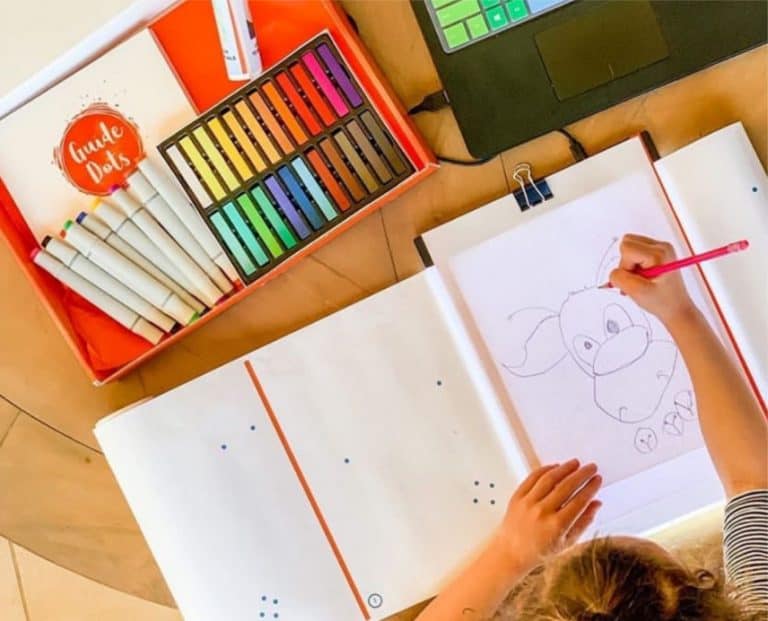
Where is `keyboard`? The image size is (768, 621). keyboard is located at coordinates (482, 17).